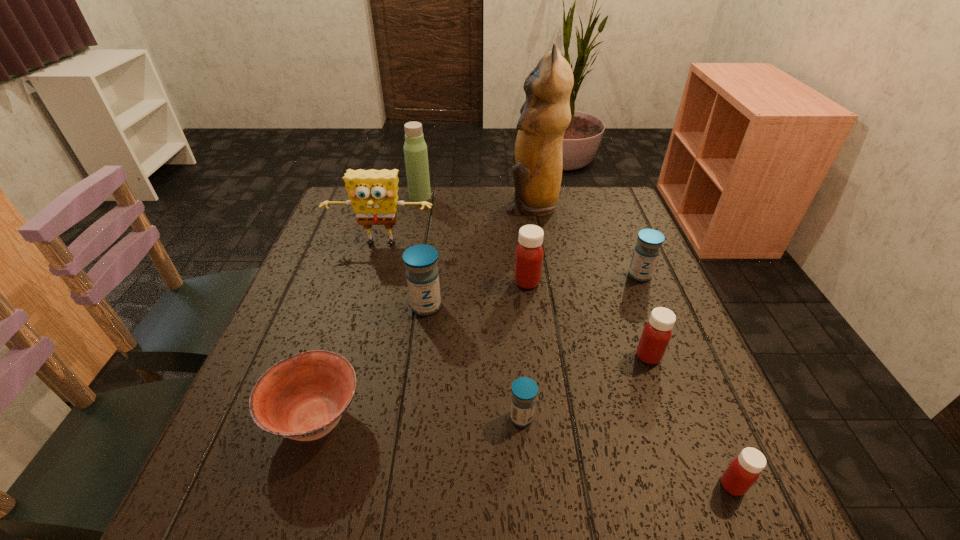
At what (x,y) coordinates should I click in order to perform the action: click on the third nearest medicine. Please return your answer as a coordinate pair (x, y). Image resolution: width=960 pixels, height=540 pixels. Looking at the image, I should click on (656, 334).

This screenshot has width=960, height=540. Find the location of `the second red medicine from right to left`. the second red medicine from right to left is located at coordinates (656, 334).

Locate an element on the screen. The height and width of the screenshot is (540, 960). bowl is located at coordinates (302, 397).

Locate an element on the screen. This screenshot has width=960, height=540. the nearest blue medicine is located at coordinates (524, 390).

Find the location of `the smallest blue medicine`. the smallest blue medicine is located at coordinates [x=524, y=390].

I want to click on the nearest object, so click(x=744, y=470).

This screenshot has width=960, height=540. In order to click on the nearest medicine in this screenshot , I will do `click(744, 470)`.

I want to click on free space located 0.140m on the face of the cat, so click(x=460, y=203).

At what (x,y) coordinates should I click in order to perform the action: click on vacant area situated on the face of the cat. Please return your answer as a coordinate pair (x, y). The width and height of the screenshot is (960, 540). Looking at the image, I should click on (473, 203).

Identify the location of free space located 0.070m on the face of the cat. Image resolution: width=960 pixels, height=540 pixels. (483, 203).